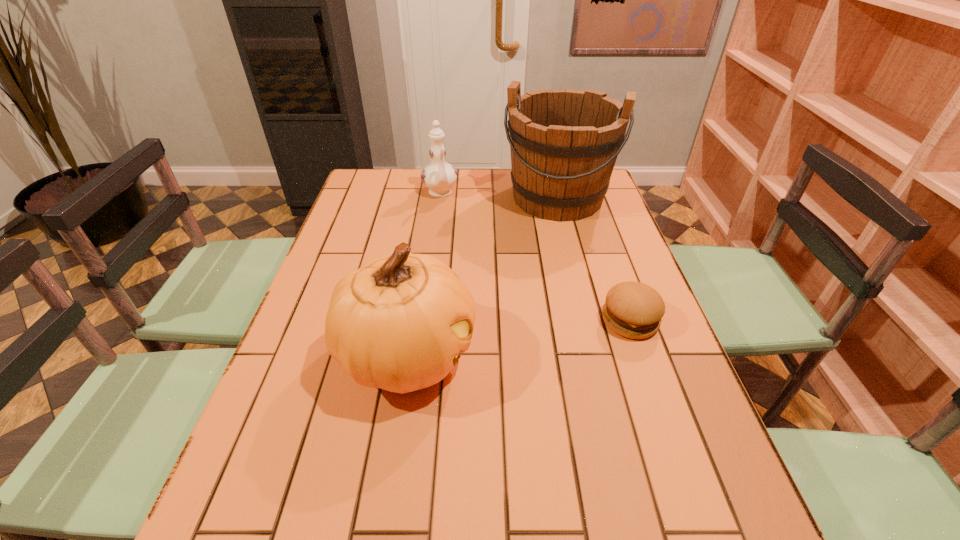
Locate an element on the screen. The width and height of the screenshot is (960, 540). free space at the left edge of the desktop is located at coordinates (283, 414).

Image resolution: width=960 pixels, height=540 pixels. Identify the location of free space at the right edge. (687, 438).

At what (x,y) coordinates should I click in order to perform the action: click on vacant space at the far left corner. Please return your answer as a coordinate pair (x, y). The width and height of the screenshot is (960, 540). Looking at the image, I should click on (355, 187).

Locate an element on the screen. This screenshot has height=540, width=960. free location at the near left corner is located at coordinates click(x=316, y=467).

Where is `free area in between the tallest object and the chinaware`? free area in between the tallest object and the chinaware is located at coordinates (498, 195).

This screenshot has height=540, width=960. I want to click on free spot between the wine bucket and the hamburger, so click(593, 259).

Where is `free space between the chinaware and the hamburger`? This screenshot has height=540, width=960. free space between the chinaware and the hamburger is located at coordinates (535, 257).

Where is `free spot between the pumpkin and the wine bucket`? free spot between the pumpkin and the wine bucket is located at coordinates (482, 276).

The width and height of the screenshot is (960, 540). What are the coordinates of `free space between the hamburger and the pumpkin` in the screenshot? It's located at (518, 338).

Locate an element on the screen. The width and height of the screenshot is (960, 540). blank region between the shortest object and the pumpkin is located at coordinates (518, 338).